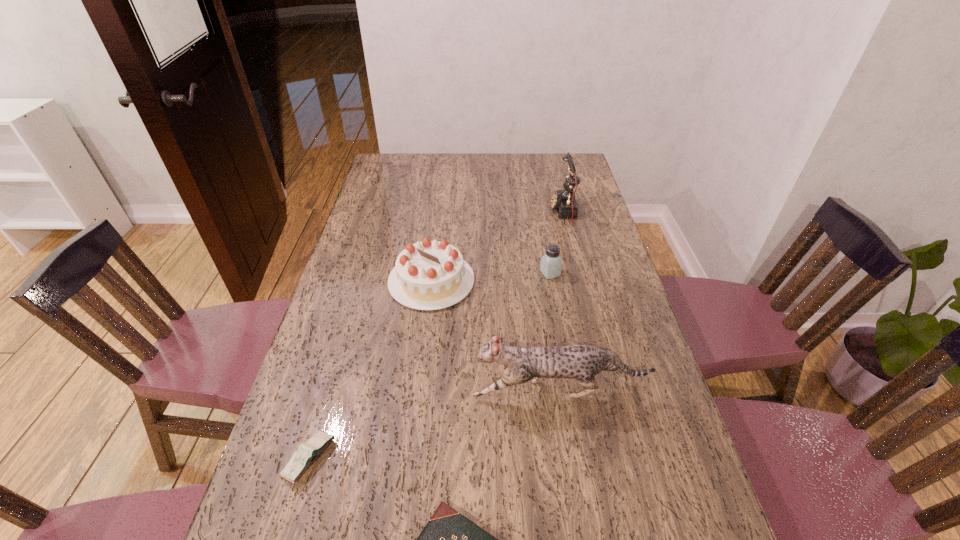
Locate an element on the screen. This screenshot has height=540, width=960. object that stands as the second closest to the telephone is located at coordinates (429, 275).

The height and width of the screenshot is (540, 960). I want to click on object identified as the second closest to the farthest object, so click(x=429, y=275).